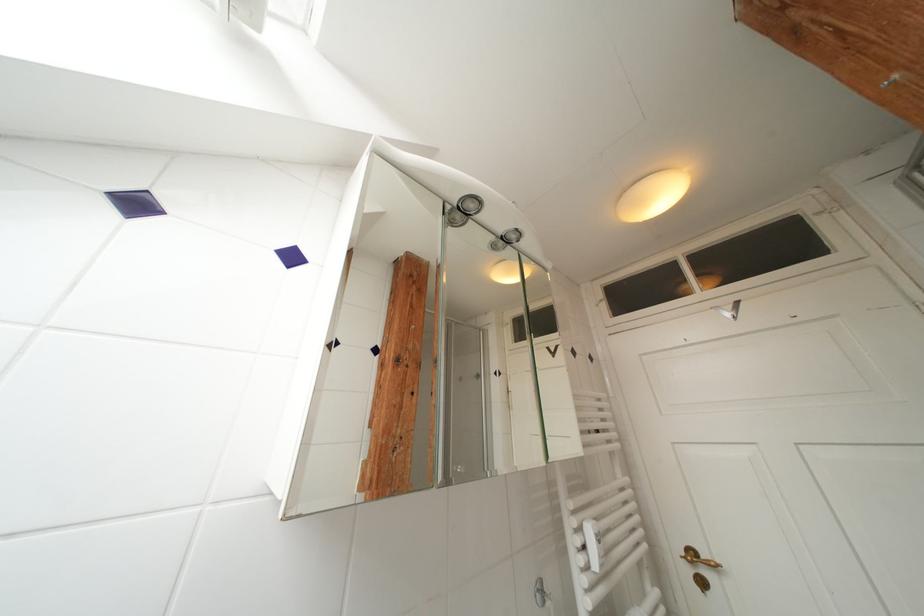
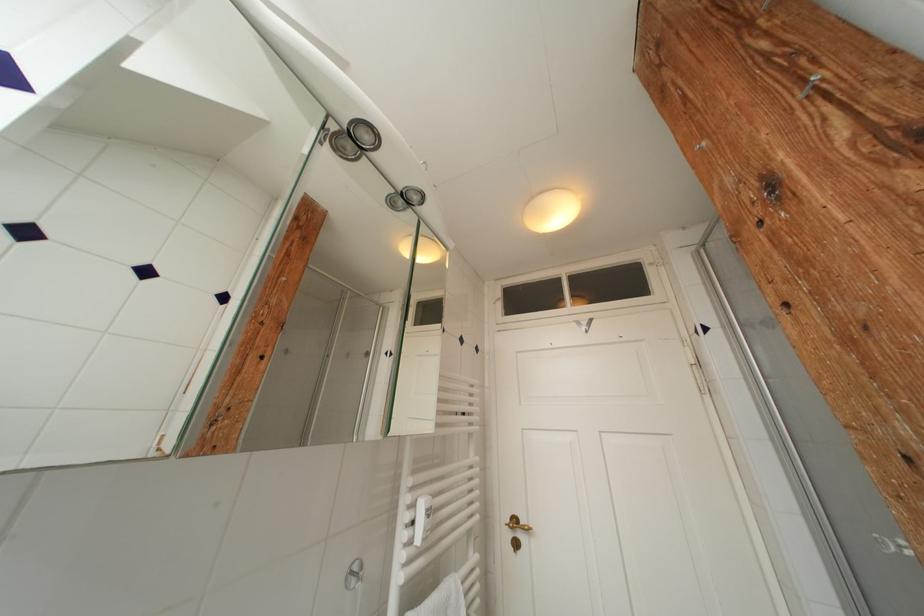
In the second image, find the point that corresponds to (x=669, y=199) in the first image.

(565, 217)